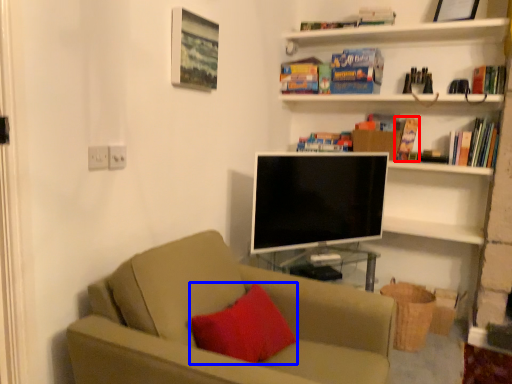
Question: Which of the following is the closest to the observer, paperback book (highlighted by a red box) or throw pillow (highlighted by a blue box)?

Choices:
 (A) paperback book
 (B) throw pillow

Answer: (B)